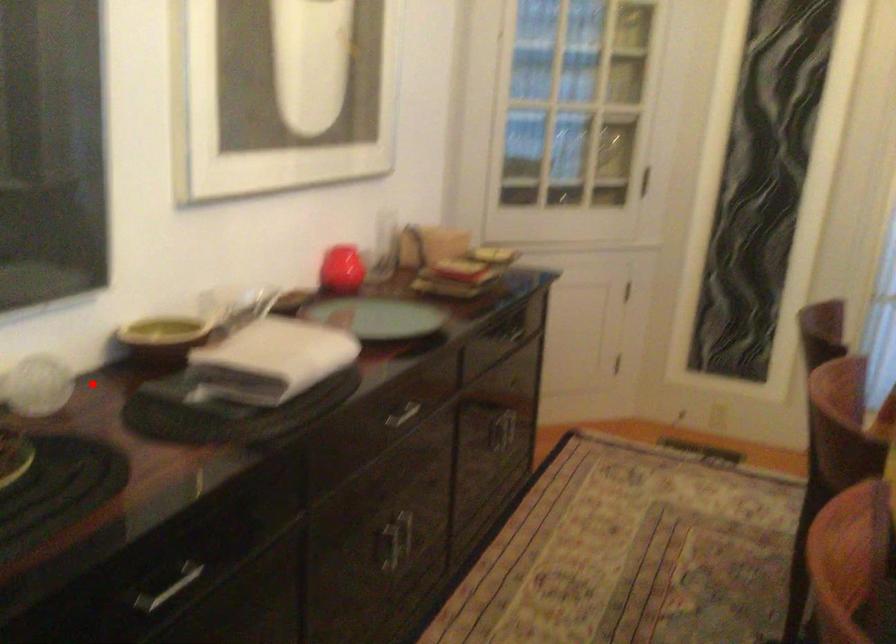
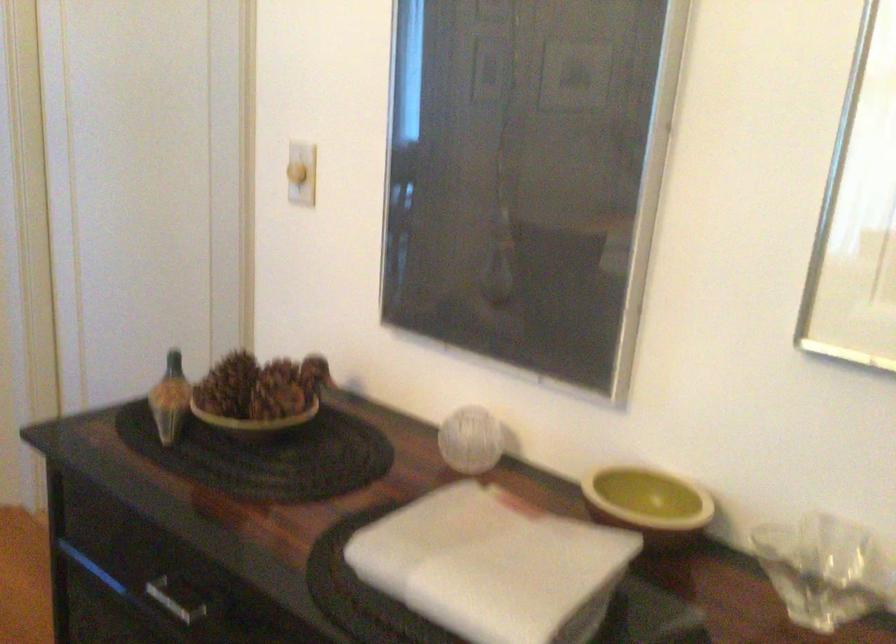
Where in the second image is the point corresponding to the highlighted location from the first image?

(470, 440)